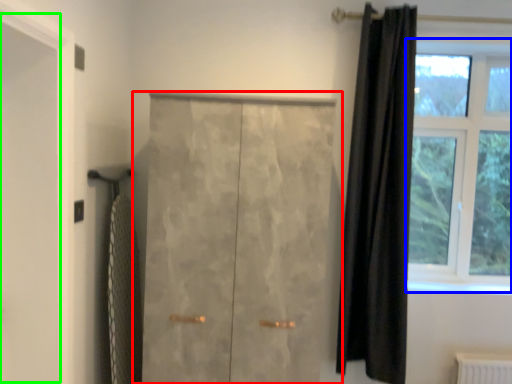
Question: Considering the real-world distances, which object is closest to door (highlighted by a red box)? window (highlighted by a blue box) or screen door (highlighted by a green box).

Choices:
 (A) window
 (B) screen door

Answer: (B)